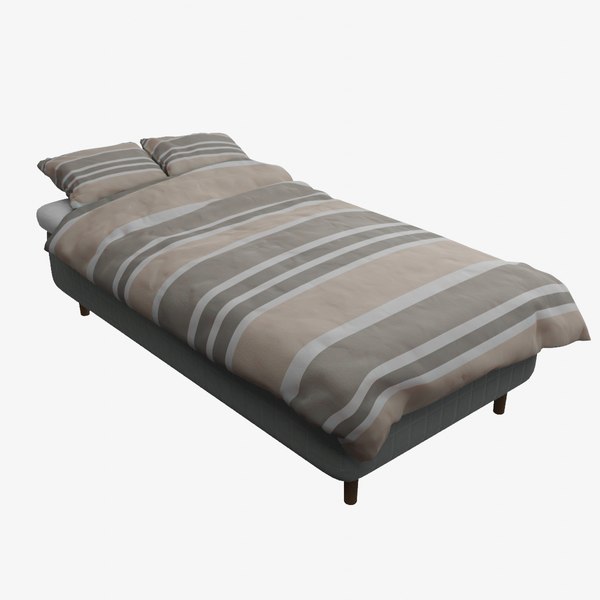
The height and width of the screenshot is (600, 600). What are the coordinates of `comforter` in the screenshot? It's located at (370, 365).